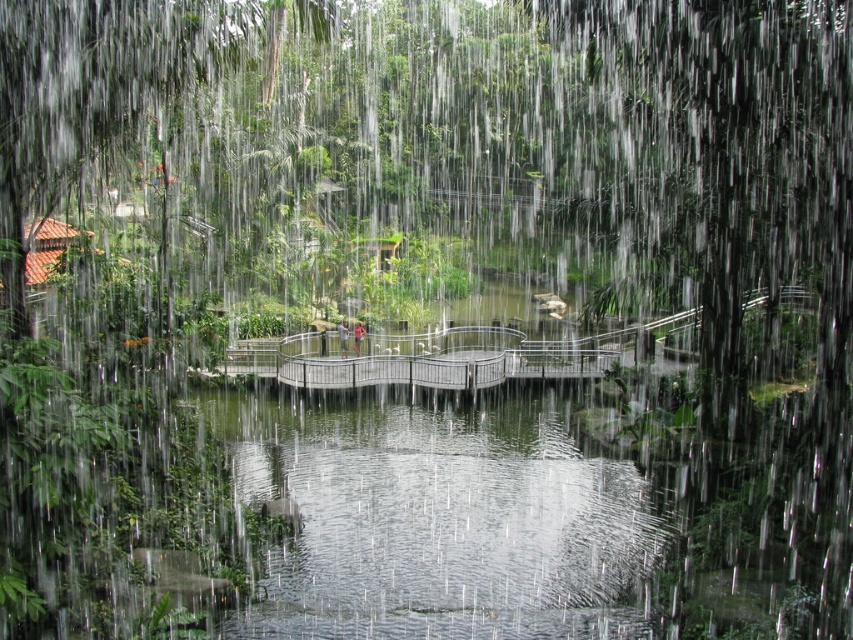
Does point (468, 372) lie behind point (339, 336)?

No, (468, 372) is closer to viewer.

This screenshot has height=640, width=853. Find the location of `metallic gray bridge at center`. metallic gray bridge at center is located at coordinates (440, 356).

The width and height of the screenshot is (853, 640). Describe the element at coordinates (341, 337) in the screenshot. I see `light brown wooden bridge at center` at that location.

What are the coordinates of `light brown wooden bridge at center` in the screenshot? It's located at (341, 337).

Where is `light brown wooden bridge at center`? light brown wooden bridge at center is located at coordinates (341, 337).

Is metallic gray bridge at center smaller than skinny jeans at center?

Actually, metallic gray bridge at center might be larger than skinny jeans at center.

Is point (787, 285) less distant than point (352, 326)?

Yes, it is in front of point (352, 326).

The image size is (853, 640). Find the location of `metallic gray bridge at center`. metallic gray bridge at center is located at coordinates tap(440, 356).